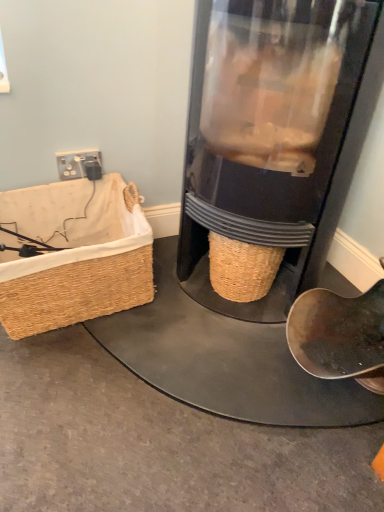
Question: From a real-world perspective, is woven straw picnic basket at left positioned above or below black plastic plug at upper left?

Choices:
 (A) below
 (B) above

Answer: (A)

Question: Looking at their shapes, would you say woven straw picnic basket at left is wider or thinner than black plastic plug at upper left?

Choices:
 (A) thin
 (B) wide

Answer: (B)

Question: Which object is positioned farthest from the transparent plastic coffee grinder at center?

Choices:
 (A) woven straw picnic basket at left
 (B) black plastic plug at upper left

Answer: (B)

Question: Which object is the farthest from the woven straw picnic basket at left?

Choices:
 (A) transparent plastic coffee grinder at center
 (B) black plastic plug at upper left

Answer: (A)